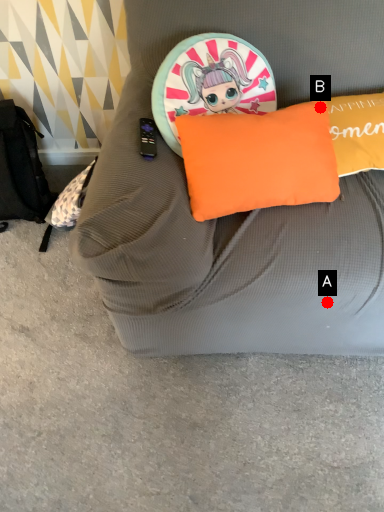
Question: Two points are circled on the image, labeled by A and B beside each circle. Which point appears farthest from the camera in this image?

Choices:
 (A) A is further
 (B) B is further

Answer: (B)